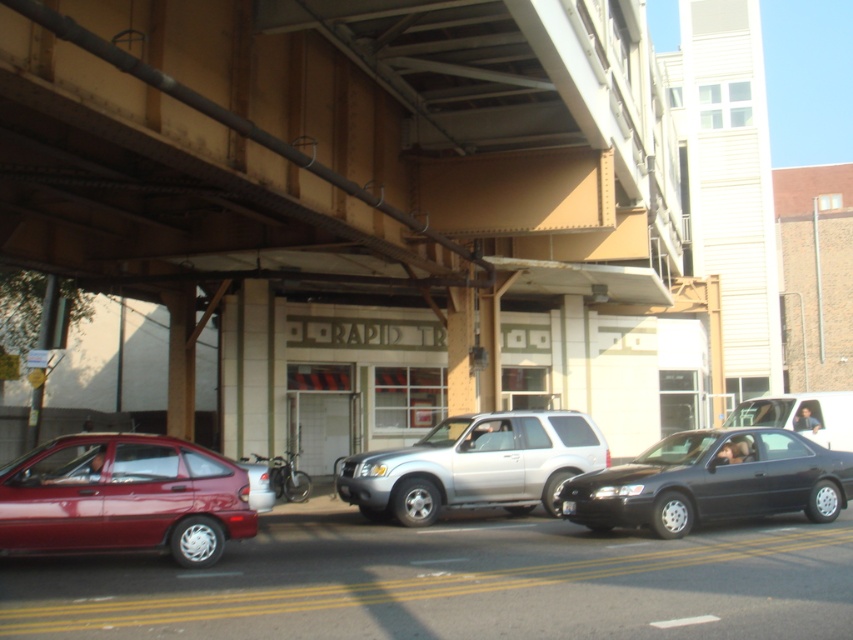
Question: Which of the following is the farthest from the observer?

Choices:
 (A) black plastic license plate at center
 (B) matte silver suv at center
 (C) brown metal/steel overpass at center
 (D) silver metallic suv at center

Answer: (B)

Question: Is brown metal/steel overpass at center thinner than matte silver suv at center?

Choices:
 (A) yes
 (B) no

Answer: (B)

Question: Does brown metal/steel overpass at center have a lesser width compared to shiny maroon hatchback at left?

Choices:
 (A) no
 (B) yes

Answer: (A)

Question: Which object is closer to the camera taking this photo?

Choices:
 (A) shiny maroon hatchback at left
 (B) black plastic license plate at center
 (C) shiny black sedan at center

Answer: (A)

Question: Does shiny black sedan at center appear on the left side of silver metallic suv at center?

Choices:
 (A) no
 (B) yes

Answer: (A)

Question: Among these points, which one is nearest to the camera?

Choices:
 (A) (93, 497)
 (B) (180, 125)
 (C) (590, 467)
 (D) (566, 500)

Answer: (B)